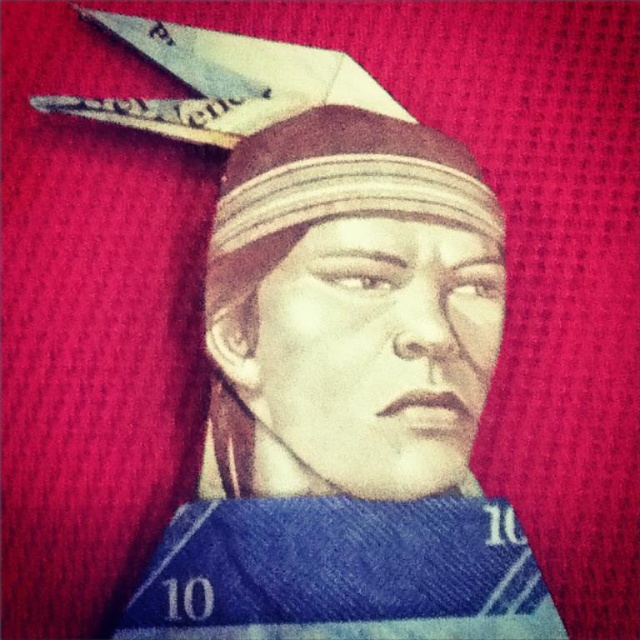
The width and height of the screenshot is (640, 640). Identify the location of smooth paper head at center. (349, 310).

Does smooth paper head at center lie behind metallic silver scissors at upper center?

That is False.

Is point (259, 244) positioned behind point (330, 92)?

No, (259, 244) is closer to viewer.

You are a GUI agent. You are given a task and a screenshot of the screen. Output one action in this format:
    pyautogui.click(x=<x>, y=<y>)
    Task: Click on the smooth paper head at center
    Image resolution: width=640 pixels, height=640 pixels.
    Given the screenshot: What is the action you would take?
    pyautogui.click(x=349, y=310)